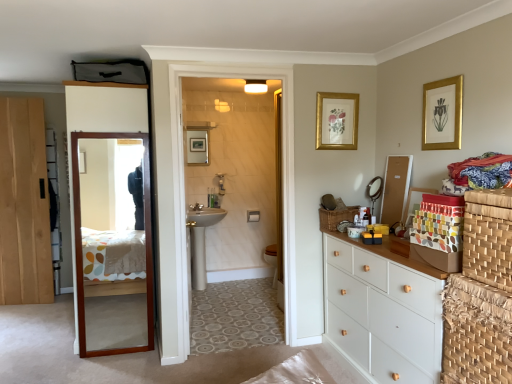
Question: From the image's perspective, is natural wood door at left, marked as the 1th door in a left-to-right arrangement, positioned above or below woven brown basket at right, which ranks as the first basket in top-to-bottom order?

Choices:
 (A) above
 (B) below

Answer: (A)

Question: Is natural wood door at left, which ranks as the second door in right-to-left order, in front of or behind woven brown basket at right, the second basket when ordered from bottom to top, in the image?

Choices:
 (A) behind
 (B) front

Answer: (A)

Question: Which of these objects is positioned farthest from the woven brown basket at right, the second basket when ordered from bottom to top?

Choices:
 (A) metallic round mirror at upper right
 (B) gold/golden picture frame at upper right, which is counted as the first picture frame, starting from the right
 (C) matte white sink at center
 (D) brown woven basket at right
 (E) brown wooden mirror at left, which is the first door in right-to-left order

Answer: (C)

Question: Estimate the real-world distances between objects in this image. Which object is closer to the metallic round mirror at upper right?

Choices:
 (A) multicolored fabric at right
 (B) gold/glass picture frame at upper center, the 2th picture frame when ordered from front to back
 (C) woven brown basket at right, which ranks as the 2th basket in right-to-left order
 (D) matte silver faucet at center
 (E) white wood chest of drawers at right

Answer: (C)